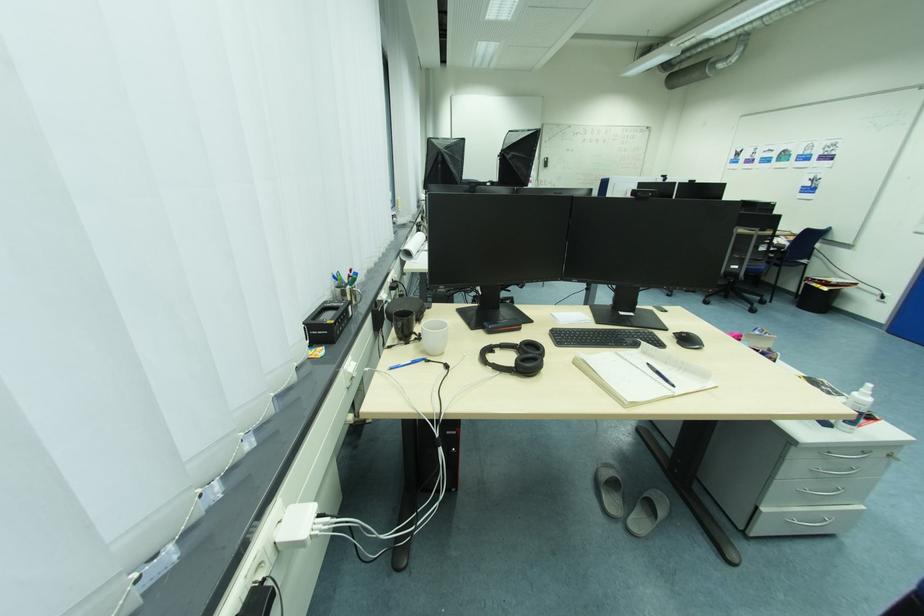
Image resolution: width=924 pixels, height=616 pixels. What are the coordinates of `white ceramic mug` in the screenshot? It's located at (433, 336).